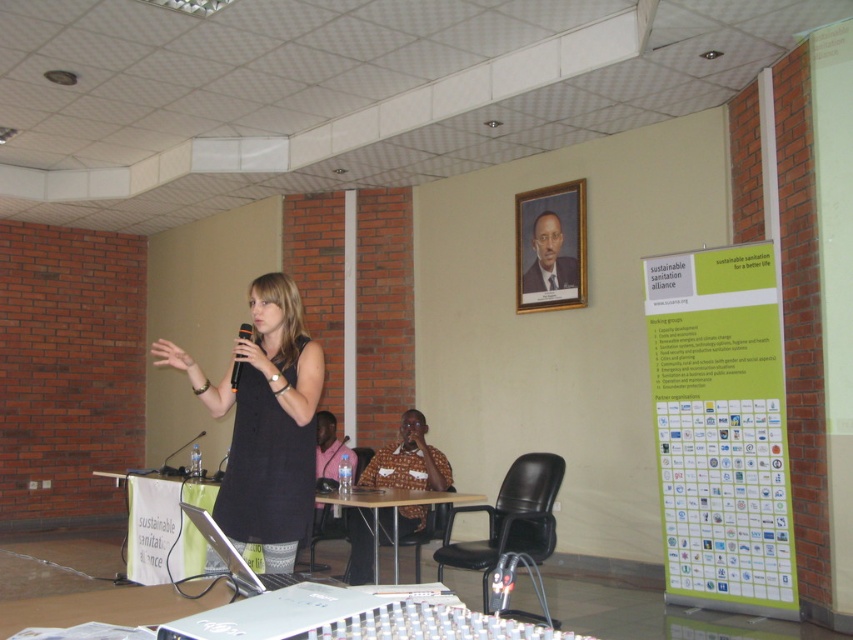
You are an attendee in the conference room and want to take a photo of the speaker wearing the black matte dress at center. The camera you have has a focal length of 50mm and a sensor size of 24mm x 36mm. If you are standing at a distance of 5 meters from the dress, what is the approximate angle of view required to capture the entire dress in the frame?

The angle of view required to capture the entire black matte dress at center can be calculated using the formula angle of view formula. The sensor size is 24mm x 36mm, focal length is 50mm. The angle of view is approximately 27 degrees vertically and 40 degrees horizontally. Since the dress is positioned at point (264, 422) in the image coordinates, the horizontal angle of view of 40 degrees would be sufficient to capture the dress within the frame when standing 5 meters away.

You are a stagehand who needs to adjust the distance between the black matte dress at center and the black leather chair at center to exactly 5 feet. Currently, they are 6.16 feet apart. What should you do?

The black matte dress at center is currently 6.16 feet away from the black leather chair at center. To reduce the distance to exactly 5 feet, you should move the black matte dress at center closer to the black leather chair at center by 1.16 feet.

You are an event organizer who needs to ensure that all materials are visible to the audience. The green paper poster at right and the black matte dress at center are both in the presentation area. Which object is taller?

The green paper poster at right is taller than the black matte dress at center.